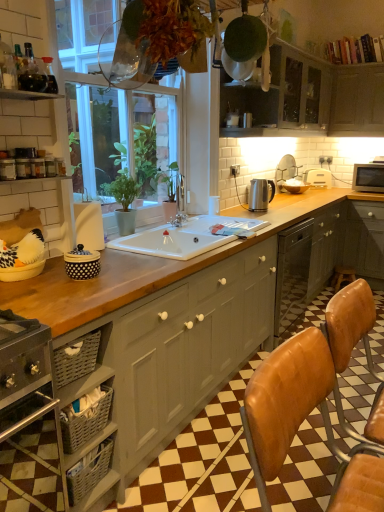
The height and width of the screenshot is (512, 384). What are the coordinates of `free point to the right of polka dot ceramic jar at left, which is the 7th appliance in right-to-left order` in the screenshot? It's located at (129, 271).